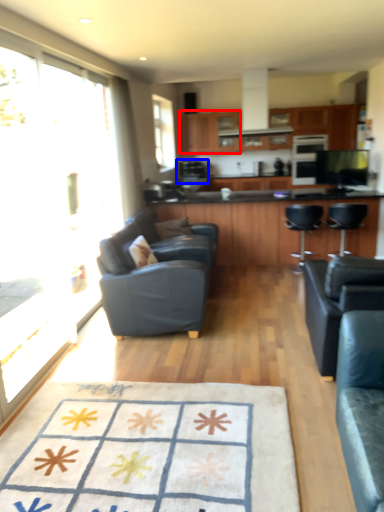
Question: Which object is closer to the camera taking this photo, cabinetry (highlighted by a red box) or coffee machine (highlighted by a blue box)?

Choices:
 (A) cabinetry
 (B) coffee machine

Answer: (A)